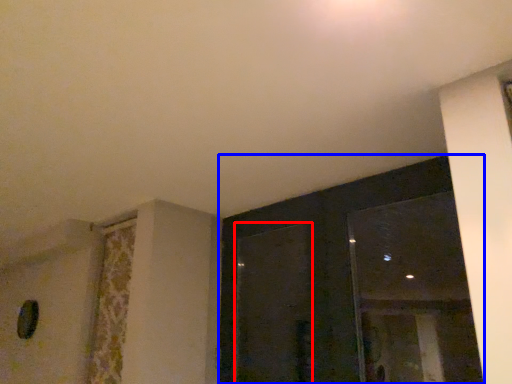
Question: Among these objects, which one is nearest to the camera, screen door (highlighted by a red box) or window (highlighted by a blue box)?

Choices:
 (A) screen door
 (B) window

Answer: (B)